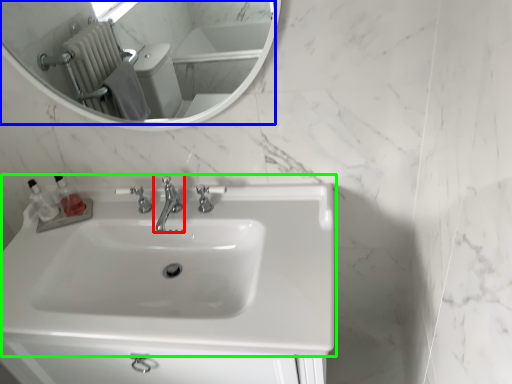
Question: Considering the real-world distances, which object is farthest from tap (highlighted by a red box)? mirror (highlighted by a blue box) or sink (highlighted by a green box)?

Choices:
 (A) mirror
 (B) sink

Answer: (A)